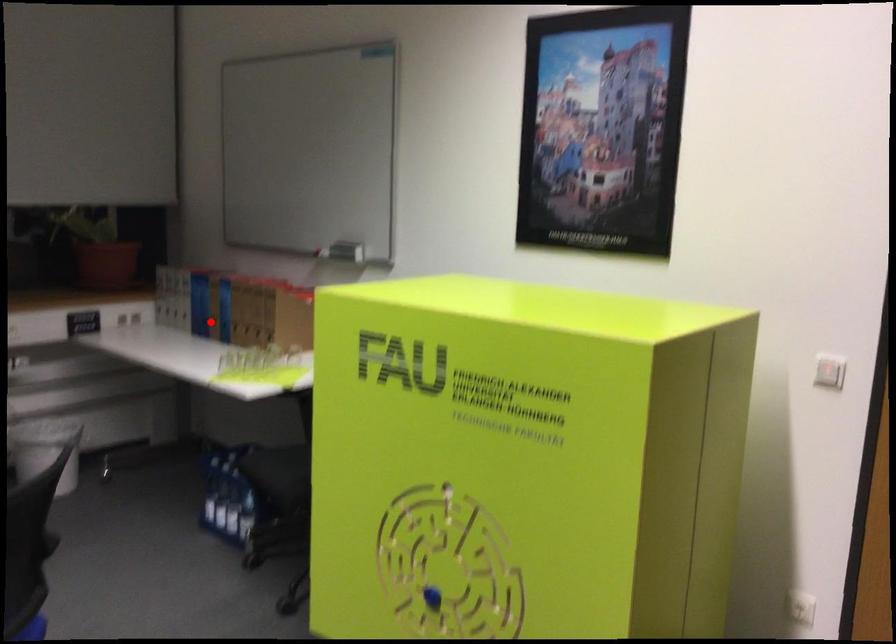
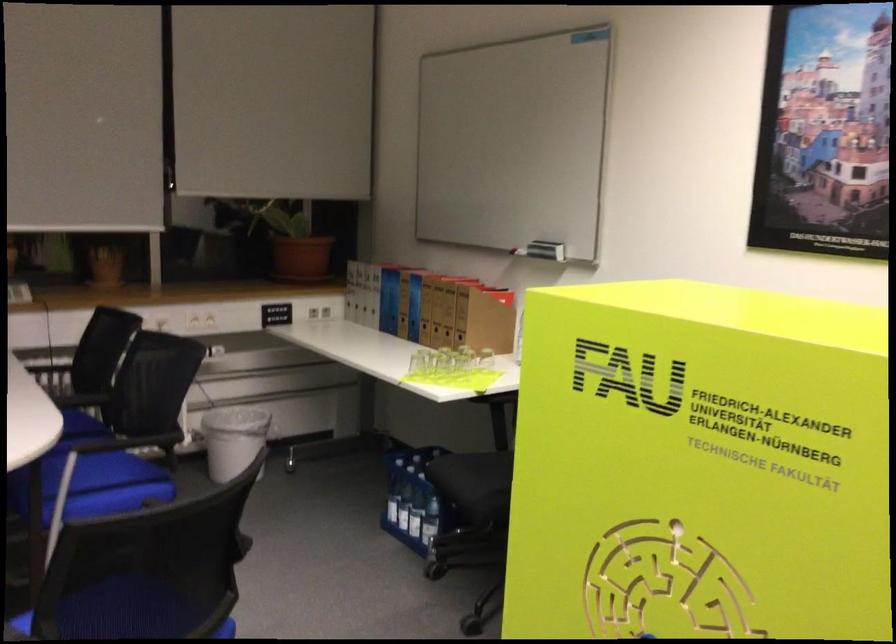
Where in the second image is the point corresponding to the highlighted location from the first image?

(398, 317)